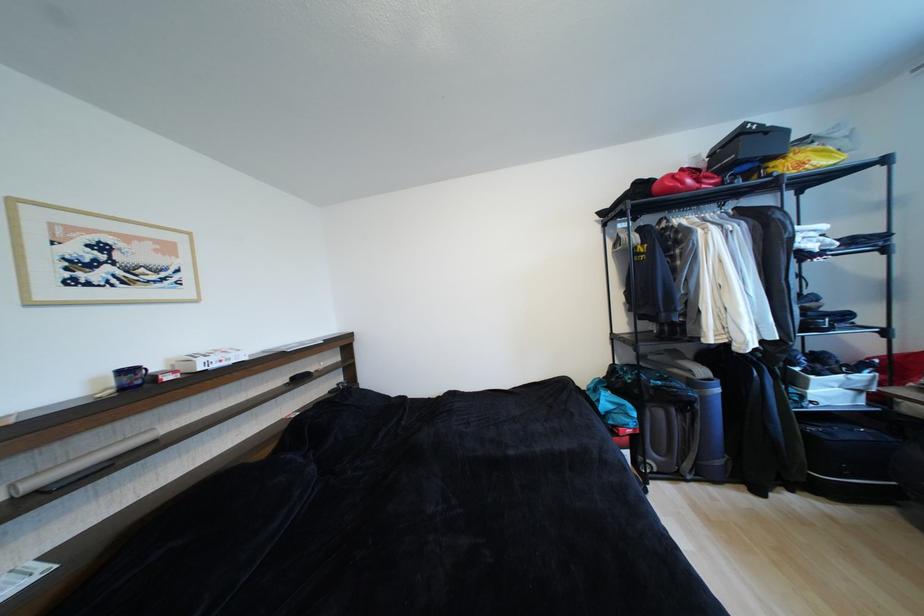
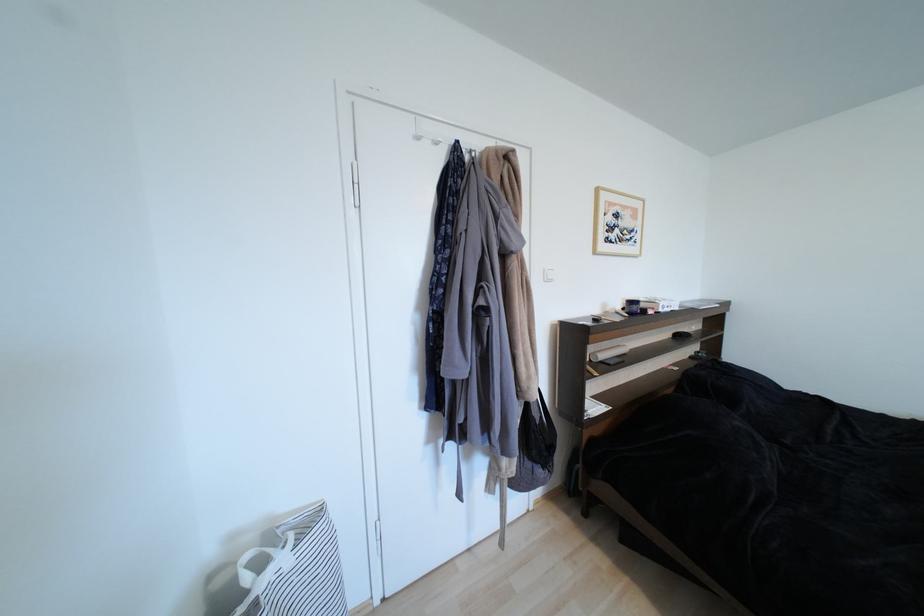
The point at (110, 249) is marked in the first image. Where is the corresponding point in the second image?

(623, 217)